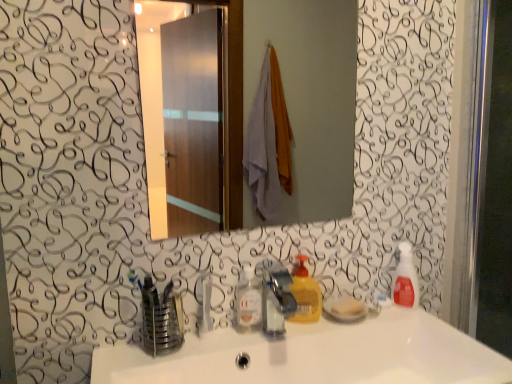
Find the location of `vacant space to the left of clear plastic bottle at center`. vacant space to the left of clear plastic bottle at center is located at coordinates (177, 345).